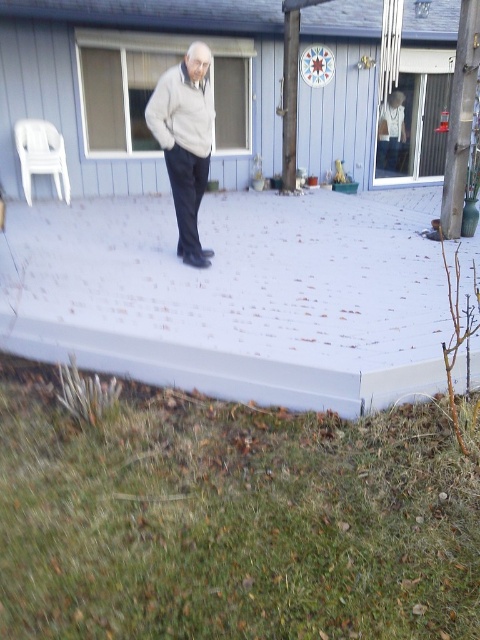
You are standing on the patio and want to take a photo of both point (x=382, y=580) and point (x=27, y=179) in the scene. Which point should you focus on first to ensure both are in clear view?

Point (x=382, y=580) is closer to the camera than point (x=27, y=179), so focusing on point (x=382, y=580) first will help ensure both are in clear view.

You are a gardener who needs to plant flowers in the green grass at lower left and the white plastic chair at left. Which area has more space available for planting?

The green grass at lower left has more space available for planting because its width is larger than the white plastic chair at left.